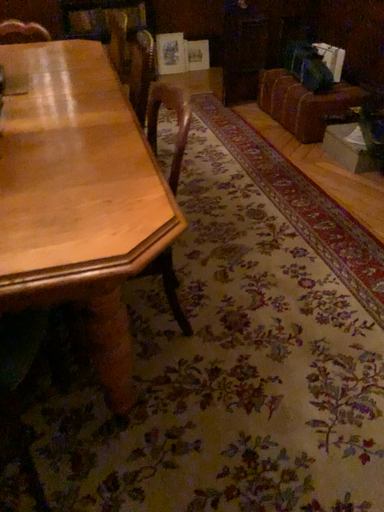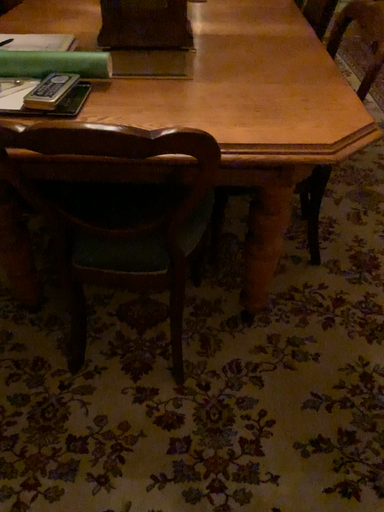
Question: Which way did the camera rotate in the video?

Choices:
 (A) rotated right
 (B) rotated left

Answer: (B)